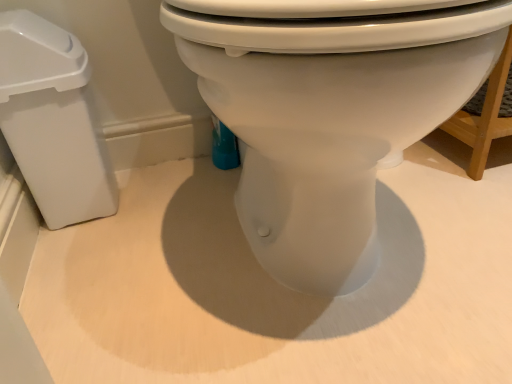
What is the approximate width of white glossy toilet at center?

The width of white glossy toilet at center is 26.84 inches.

This screenshot has height=384, width=512. Describe the element at coordinates (330, 118) in the screenshot. I see `white glossy toilet at center` at that location.

Identify the location of white glossy toilet at center. The image size is (512, 384). (330, 118).

Measure the distance between point (x=478, y=10) and camera.

A distance of 12.76 inches exists between point (x=478, y=10) and camera.

The height and width of the screenshot is (384, 512). I want to click on white glossy toilet at center, so click(x=330, y=118).